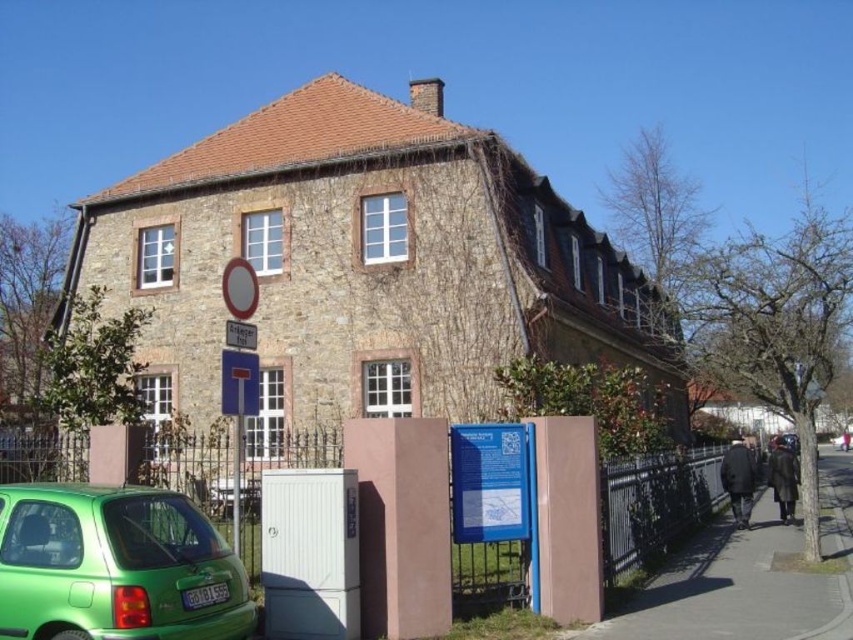
You are a visitor arriving at the historical site and see the green matte hatchback at lower left and the metallic silver fence at lower center. Which object is closer to the entrance of the building?

The green matte hatchback at lower left is above the metallic silver fence at lower center, so it is closer to the entrance of the building.

Based on the photo, you are driving a car that is 4 meters long and need to park it in the parking area near the green matte hatchback at lower left and the metallic silver fence at lower center. Can you safely park your car between them without hitting either object?

The distance between the green matte hatchback at lower left and the metallic silver fence at lower center is 4.13 meters. Since your car is 4 meters long, there is enough space to park safely between them without hitting either object.

You are standing in front of the stone building with the reddish brown roof. You see a point marked at coordinate (115, 566). What object is located at that point?

The point at coordinate (115, 566) indicates a green matte hatchback at lower left.